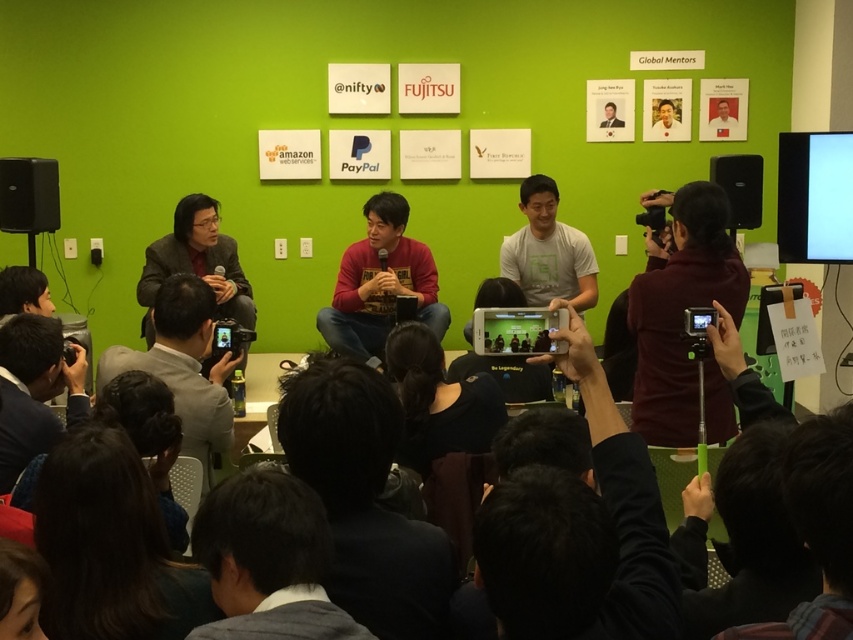
Question: In this image, where is matte red sweater at center located relative to black matte speaker at left?

Choices:
 (A) above
 (B) below

Answer: (B)

Question: Estimate the real-world distances between objects in this image. Which object is closer to the black matte speaker at right?

Choices:
 (A) matte red sweater at center
 (B) black matte speaker at left

Answer: (A)

Question: Is the position of dark hair at lower center less distant than that of black matte speaker at right?

Choices:
 (A) no
 (B) yes

Answer: (B)

Question: Which object is the closest to the black matte speaker at right?

Choices:
 (A) dark hair at lower center
 (B) black matte speaker at left
 (C) matte red sweater at center

Answer: (C)

Question: From the image, what is the correct spatial relationship of dark hair at lower center in relation to black matte speaker at left?

Choices:
 (A) left
 (B) right

Answer: (B)

Question: Which object is closer to the camera taking this photo?

Choices:
 (A) dark hair at lower center
 (B) black matte speaker at left
 (C) matte red sweater at center

Answer: (A)